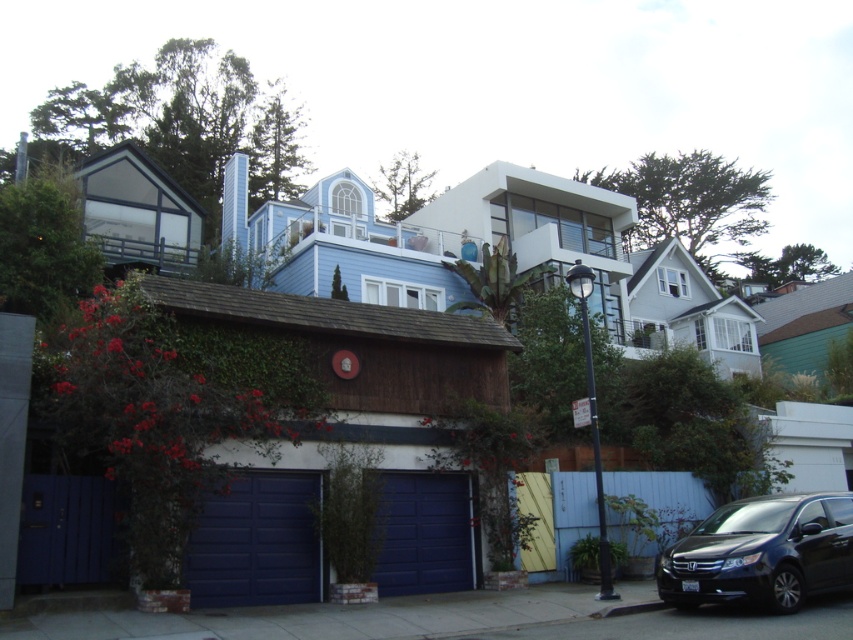
Looking at this image, you are a delivery driver approaching the residential street in the image. You need to park your vehicle near the black glossy minivan at lower right and the blue smooth garage door at lower left. Which object should you park closer to if you want to be nearer to both?

You should park closer to the black glossy minivan at lower right because it is nearer to the viewer, so positioning yourself there would place you closer to both objects compared to the blue smooth garage door at lower left which is farther away.